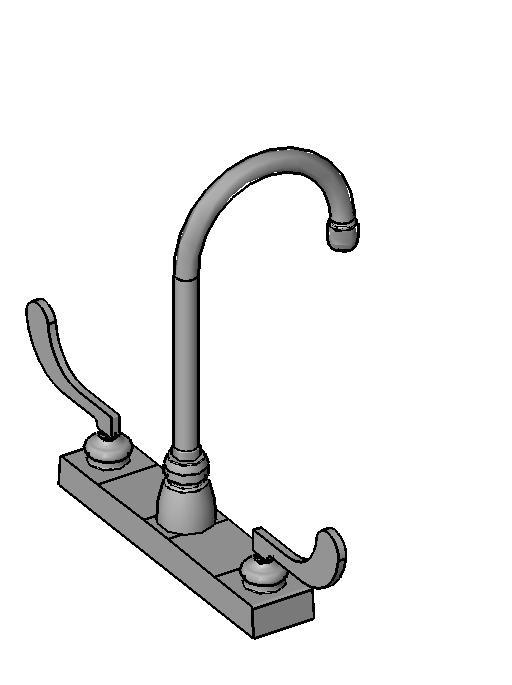
Where is `1 knob on the right side`? 1 knob on the right side is located at coordinates (313, 558).